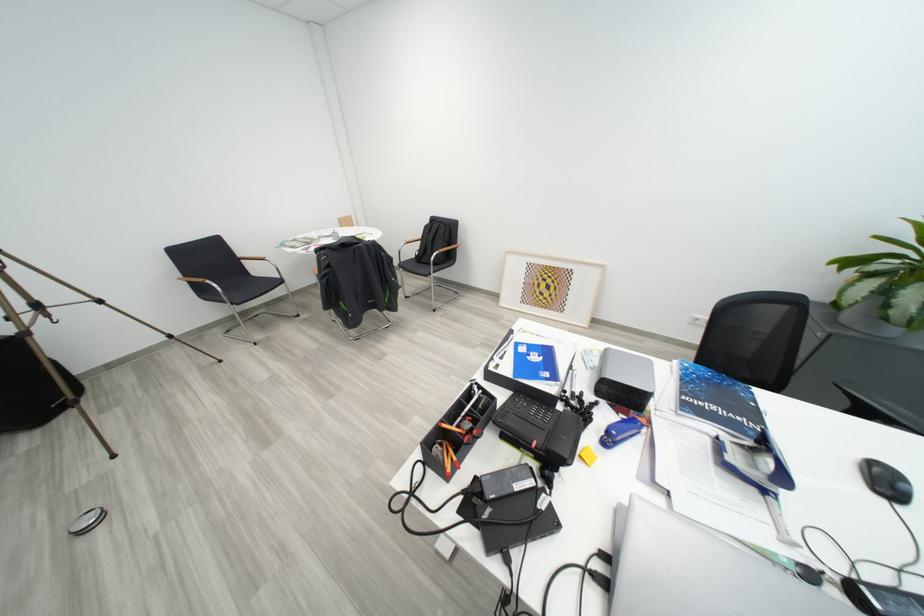
Find the location of a particular element. black phone handset is located at coordinates (562, 440).